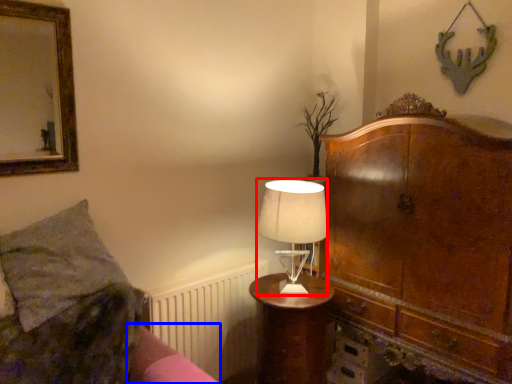
Question: Which point is closer to the camera, table lamp (highlighted by a red box) or bed frame (highlighted by a blue box)?

Choices:
 (A) table lamp
 (B) bed frame

Answer: (B)